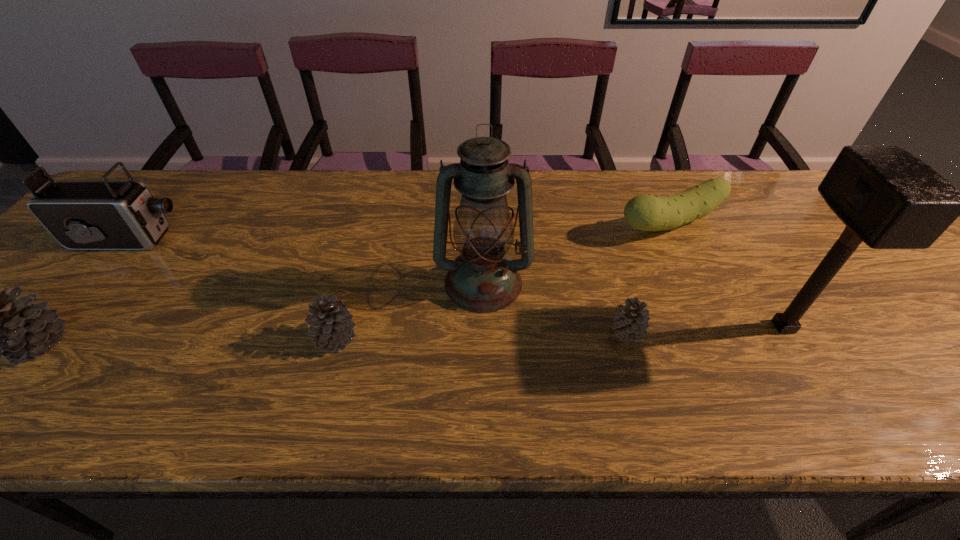
I want to click on vacant area between the cucumber and the third object from right to left, so tap(649, 279).

The height and width of the screenshot is (540, 960). In order to click on free area in between the mallet and the second shortest pinecone in this screenshot , I will do point(560,333).

The width and height of the screenshot is (960, 540). In order to click on empty location between the third tallest object and the oil lamp in this screenshot , I will do `click(305, 261)`.

This screenshot has height=540, width=960. Identify the location of unoccupied position between the fifth shortest object and the third object from left to right. (231, 289).

At what (x,y) coordinates should I click in order to perform the action: click on vacant space in between the fifth object from right to left and the camcorder. Please return your answer as a coordinate pair (x, y). Looking at the image, I should click on (231, 289).

Where is `vacant area that lies between the third object from left to right and the oil lamp`? The width and height of the screenshot is (960, 540). vacant area that lies between the third object from left to right and the oil lamp is located at coordinates (409, 310).

Identify which object is located as the third nearest to the oil lamp. Please provide its 2D coordinates. Your answer should be formatted as a tuple, i.e. [(x, y)], where the tuple contains the x and y coordinates of a point satisfying the conditions above.

[(648, 212)]

Where is `object that is the fourth closest to the mallet`? The height and width of the screenshot is (540, 960). object that is the fourth closest to the mallet is located at coordinates (331, 323).

The height and width of the screenshot is (540, 960). Identify the location of pinecone that stands as the second closest to the shortest pinecone. (0, 325).

The image size is (960, 540). In order to click on pinecone that is the third closest to the oil lamp in this screenshot , I will do `click(0, 325)`.